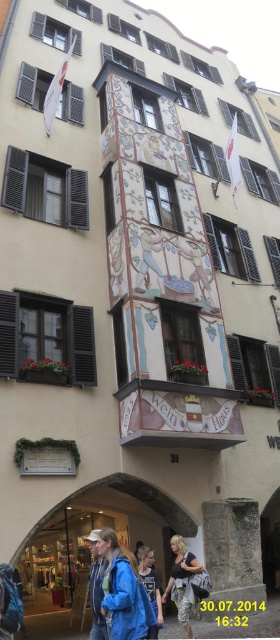
Question: Does decorative painted facade at center appear over blue fleece jacket at lower left?

Choices:
 (A) no
 (B) yes

Answer: (B)

Question: Which of the following is the closest to the observer?

Choices:
 (A) (190, 552)
 (B) (124, 129)
 (C) (106, 636)
 (D) (103, 600)

Answer: (D)

Question: Which of the following is the closest to the observer?

Choices:
 (A) blue denim jacket at lower left
 (B) blue fleece jacket at lower left

Answer: (B)

Question: Estimate the real-world distances between objects in this image. Which object is closer to the blue denim jacket at lower center?

Choices:
 (A) decorative painted facade at center
 (B) camouflage-patterned shorts at center
 (C) blue denim jacket at lower left

Answer: (B)

Question: Is blue fleece jacket at lower left above blue denim jacket at lower center?

Choices:
 (A) no
 (B) yes

Answer: (B)

Question: Can you confirm if decorative painted facade at center is smaller than camouflage-patterned shorts at center?

Choices:
 (A) yes
 (B) no

Answer: (B)